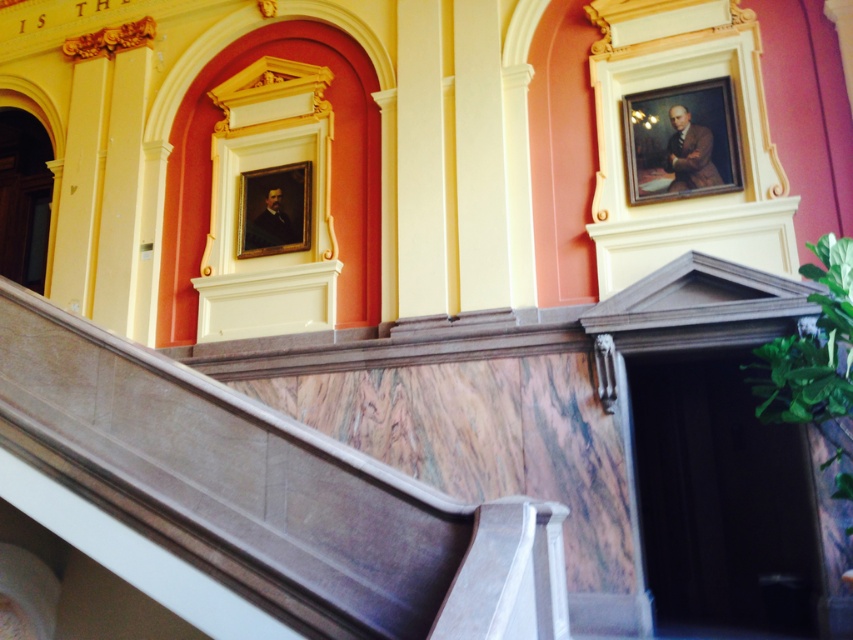
You are an art conservator tasked with assessing the placement of the oil painting portrait at upper right. Considering the marble stairs at center are directly beneath it, could there be potential risks to the portrait due to the stairs being underneath?

The marble stairs at center are positioned under the oil painting portrait at upper right, which might pose risks such as vibrations from foot traffic or moisture rising from the stairs affecting the portrait.

You are an art conservator assessing the placement of artworks in this grand building. You need to determine the vertical positioning of the oil painting portrait at upper right and the matte gold frame at upper center. Which one is placed higher up on the wall?

The oil painting portrait at upper right is placed higher up on the wall than the matte gold frame at upper center because it is positioned above it.

You are an interior designer assessing the layout of this grand building. You notice the marble stairs at center and the matte gold frame at upper center. Based on their positions, which object is positioned to the left of the other?

The matte gold frame at upper center is positioned to the left of the marble stairs at center.